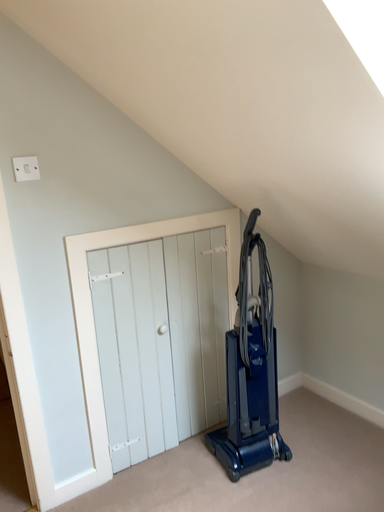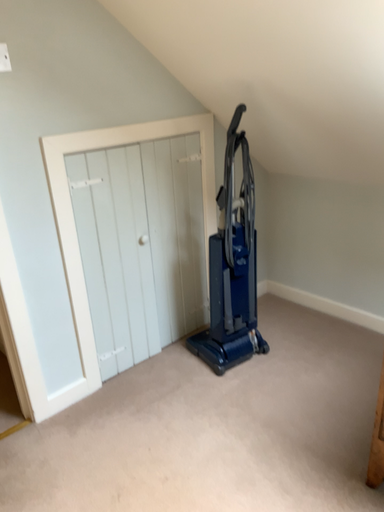
Question: How did the camera likely rotate when shooting the video?

Choices:
 (A) rotated left
 (B) rotated right

Answer: (B)